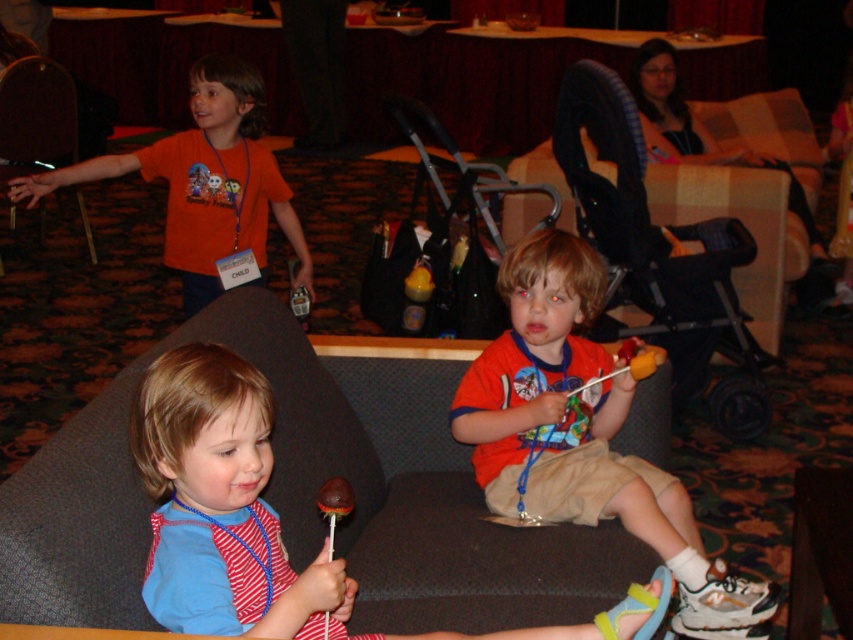
Question: Where is striped cotton shirt at lower left located in relation to wooden chair at left in the image?

Choices:
 (A) below
 (B) above

Answer: (A)

Question: Which point is farther to the camera?

Choices:
 (A) (7, 96)
 (B) (653, 476)

Answer: (A)

Question: Which point is closer to the camera taking this photo?

Choices:
 (A) (49, 104)
 (B) (218, 493)
 (C) (740, 416)
 (D) (637, 524)

Answer: (B)

Question: Which of the following is the farthest from the observer?

Choices:
 (A) (670, 534)
 (B) (715, 324)
 (C) (36, 144)

Answer: (C)

Question: Is striped cotton shirt at lower left bigger than wooden chair at left?

Choices:
 (A) yes
 (B) no

Answer: (B)

Question: Is striped cotton shirt at lower left bigger than black plastic stroller at center?

Choices:
 (A) yes
 (B) no

Answer: (B)